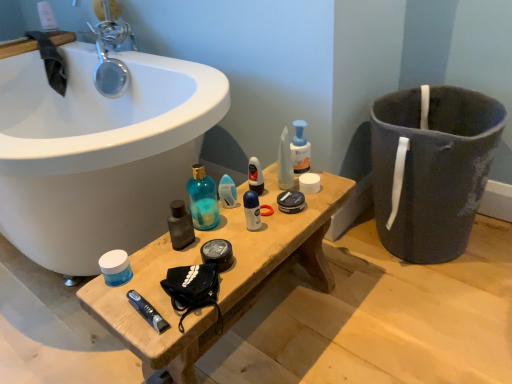
Question: Is white matte deodorant at center, arranged as the 2th toiletry when viewed from the left, taller or shorter than shiny plastic mouthwash at center, which is the 2th mouthwash from right to left?

Choices:
 (A) short
 (B) tall

Answer: (A)

Question: Relative to shiny plastic mouthwash at center, which ranks as the second mouthwash in left-to-right order, is white matte deodorant at center, arranged as the 2th toiletry when viewed from the left, in front or behind?

Choices:
 (A) behind
 (B) front

Answer: (B)

Question: Estimate the real-world distances between objects in this image. Which object is farther from the wooden bench at center?

Choices:
 (A) translucent plastic bottle at center, the 3th mouthwash in the bottom-to-top sequence
 (B) translucent plastic soap dispenser at center, marked as the 3th toiletry in a left-to-right arrangement
 (C) white matte deodorant at center, the 2th toiletry in the right-to-left sequence
 (D) translucent plastic deodorant at center, the 3th toiletry positioned from the right
 (E) blue matte jar at center, the 1th mouthwash from the bottom

Answer: (A)

Question: Considering the real-world distances, which object is farthest from the translucent plastic deodorant at center, the 1th toiletry positioned from the left?

Choices:
 (A) translucent plastic bottle at center, acting as the 3th mouthwash starting from the left
 (B) wooden bench at center
 (C) blue matte toothpaste at center
 (D) translucent plastic soap dispenser at center, marked as the 3th toiletry in a left-to-right arrangement
 (E) white matte deodorant at center, the 2th toiletry in the right-to-left sequence

Answer: (C)